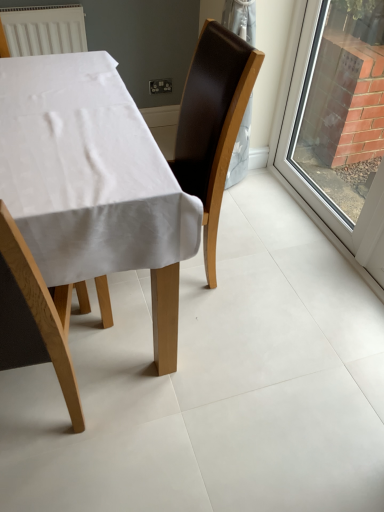
Locate an element on the screen. The image size is (384, 512). vacant space in front of brown leather chair at center, the 2th chair from the front is located at coordinates (208, 360).